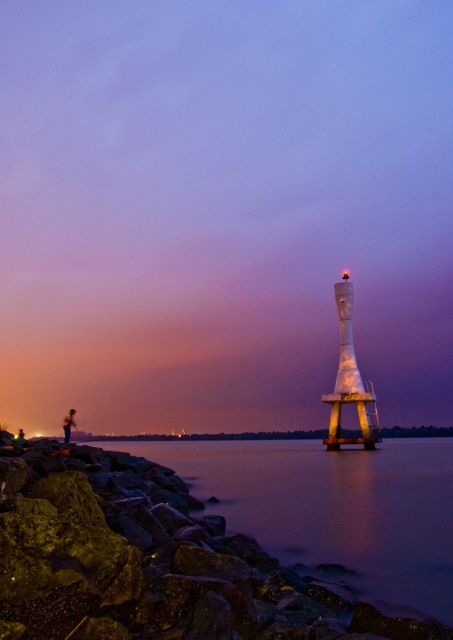
Question: Observing the image, what is the correct spatial positioning of smooth water at lower left in reference to white glossy tower at center?

Choices:
 (A) below
 (B) above

Answer: (A)

Question: Among these objects, which one is farthest from the camera?

Choices:
 (A) smooth water at lower left
 (B) white glossy tower at center

Answer: (B)

Question: Which object is closer to the camera taking this photo?

Choices:
 (A) white glossy tower at center
 (B) metallic figure at lower left

Answer: (B)

Question: Among these points, which one is nearest to the camera?

Choices:
 (A) (68, 429)
 (B) (444, 506)
 (C) (347, 397)

Answer: (B)

Question: Can you confirm if smooth water at lower left is bigger than metallic figure at lower left?

Choices:
 (A) no
 (B) yes

Answer: (B)

Question: Can you confirm if white glossy tower at center is positioned to the left of metallic figure at lower left?

Choices:
 (A) yes
 (B) no

Answer: (B)